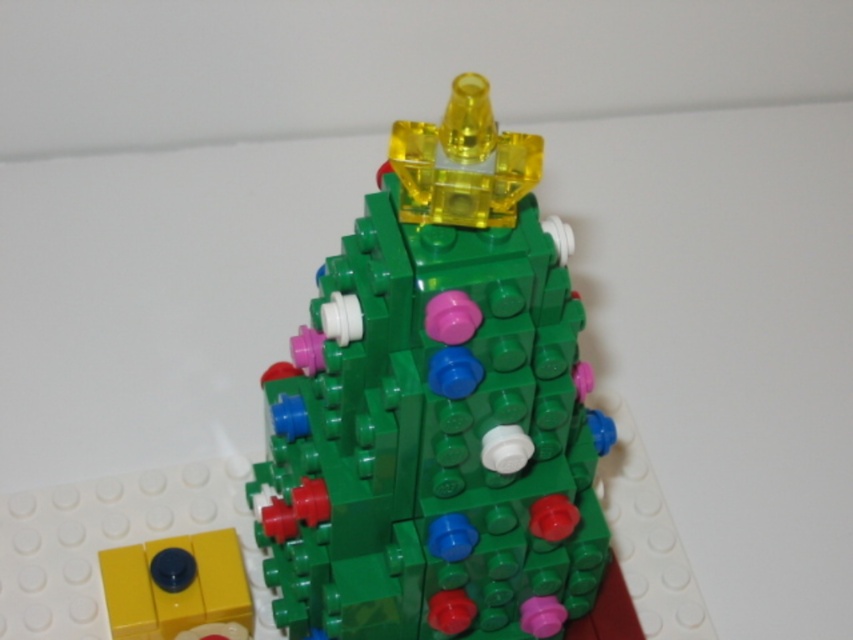
You are a toy designer who needs to package this LEGO Christmas tree. The packaging box has a height limit of 12 inches. Can the tree fit vertically in the box without bending or damaging it? Please consider the distance between the translucent yellow plastic at top and the matte yellow brick at bottom left.

The distance between the translucent yellow plastic at top and the matte yellow brick at bottom left is 11.69 inches, which is under the 12 inch height limit. Therefore, the tree can fit vertically in the box without bending or damaging it.

You are trying to determine if the translucent yellow plastic at top can be placed on top of the matte yellow brick at bottom left. Based on their sizes, will it fit?

The translucent yellow plastic at top might be wider than matte yellow brick at bottom left, so it may not fit properly on top of it.